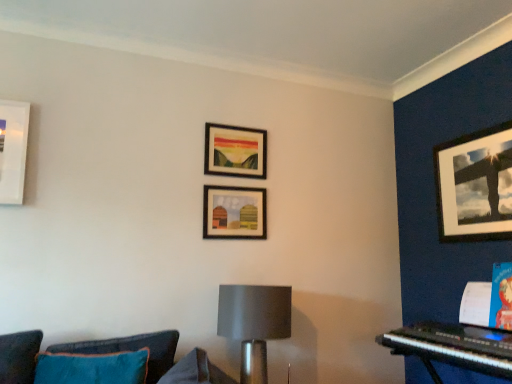
Question: Is matte black picture frame at upper right, the third picture frame in the left-to-right sequence, oriented towards matte wooden picture frame at center, which appears as the 2th picture frame when viewed from the left?

Choices:
 (A) no
 (B) yes

Answer: (B)

Question: Does matte black picture frame at upper right, the first picture frame from the right, have a greater width compared to matte wooden picture frame at center, positioned as the second picture frame in right-to-left order?

Choices:
 (A) no
 (B) yes

Answer: (B)

Question: From a real-world perspective, does matte black picture frame at upper right, the first picture frame from the right, sit lower than matte wooden picture frame at center, which appears as the 2th picture frame when viewed from the left?

Choices:
 (A) yes
 (B) no

Answer: (B)

Question: Considering the relative positions of matte black picture frame at upper right, the third picture frame in the left-to-right sequence, and matte wooden picture frame at center, which appears as the 2th picture frame when viewed from the left, in the image provided, is matte black picture frame at upper right, the third picture frame in the left-to-right sequence, to the right of matte wooden picture frame at center, which appears as the 2th picture frame when viewed from the left, from the viewer's perspective?

Choices:
 (A) yes
 (B) no

Answer: (A)

Question: Is matte wooden picture frame at center, which appears as the 2th picture frame when viewed from the left, a part of matte black picture frame at upper right, the first picture frame from the right?

Choices:
 (A) yes
 (B) no

Answer: (B)

Question: From a real-world perspective, is matte black picture frame at upper right, the third picture frame in the left-to-right sequence, on top of matte wooden picture frame at center, positioned as the second picture frame in right-to-left order?

Choices:
 (A) yes
 (B) no

Answer: (A)

Question: Considering the relative sizes of matte gray lampshade at center and black plastic keyboard at lower right in the image provided, is matte gray lampshade at center bigger than black plastic keyboard at lower right?

Choices:
 (A) yes
 (B) no

Answer: (A)

Question: Considering the relative positions of matte gray lampshade at center and black plastic keyboard at lower right in the image provided, is matte gray lampshade at center behind black plastic keyboard at lower right?

Choices:
 (A) yes
 (B) no

Answer: (A)

Question: Can you confirm if matte gray lampshade at center is taller than black plastic keyboard at lower right?

Choices:
 (A) no
 (B) yes

Answer: (B)

Question: Can you confirm if matte gray lampshade at center is wider than black plastic keyboard at lower right?

Choices:
 (A) no
 (B) yes

Answer: (A)

Question: Is matte gray lampshade at center shorter than black plastic keyboard at lower right?

Choices:
 (A) no
 (B) yes

Answer: (A)

Question: From a real-world perspective, is matte gray lampshade at center located beneath black plastic keyboard at lower right?

Choices:
 (A) no
 (B) yes

Answer: (B)

Question: Is matte black picture frame at upper right, the first picture frame from the right, oriented away from teal fabric couch at lower left?

Choices:
 (A) yes
 (B) no

Answer: (B)